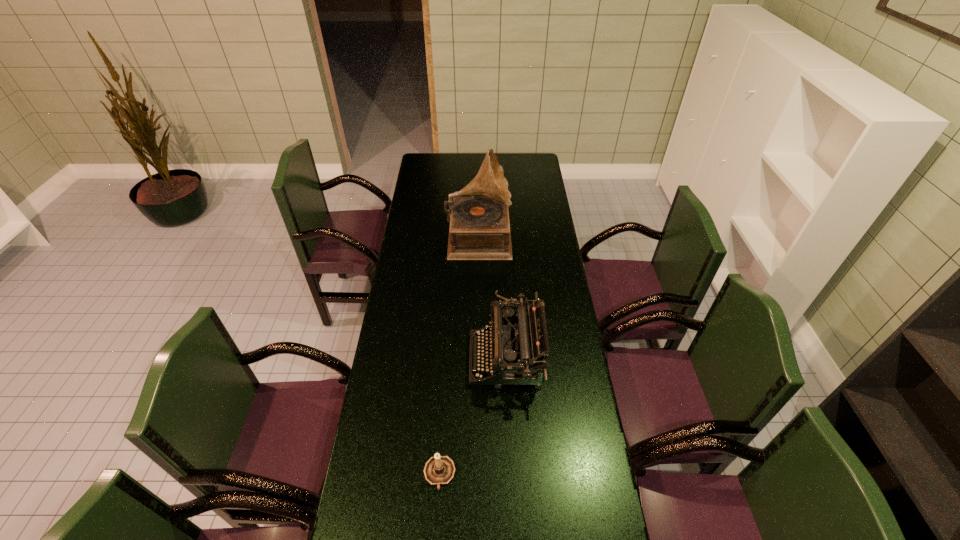
At what (x,y) coordinates should I click in order to perform the action: click on the tallest object. Please return your answer as a coordinate pair (x, y). The image size is (960, 540). Looking at the image, I should click on (479, 229).

Locate an element on the screen. The image size is (960, 540). the farthest object is located at coordinates (479, 229).

Locate an element on the screen. This screenshot has width=960, height=540. the second nearest object is located at coordinates (518, 342).

Locate an element on the screen. This screenshot has height=540, width=960. the second tallest object is located at coordinates (518, 342).

Where is `candle holder`? This screenshot has width=960, height=540. candle holder is located at coordinates pos(439,470).

Identify the location of the shortest object. (439, 470).

Where is `vacant area located 0.100m from the horn of the record player`? vacant area located 0.100m from the horn of the record player is located at coordinates (531, 234).

Where is `vacant space located 0.050m on the keyboard of the second nearest object`? Image resolution: width=960 pixels, height=540 pixels. vacant space located 0.050m on the keyboard of the second nearest object is located at coordinates (456, 360).

Identify the location of vacant space located on the keyboard of the second nearest object. (413, 360).

Locate an element on the screen. The image size is (960, 540). vacant space located on the keyboard of the second nearest object is located at coordinates 443,360.